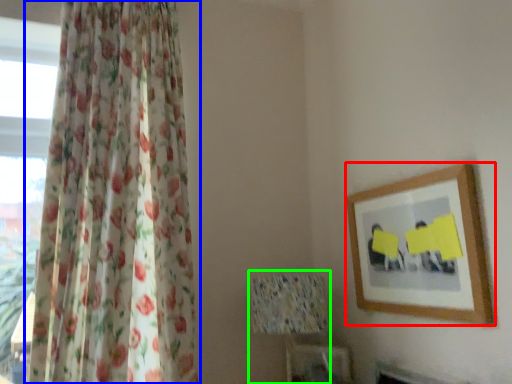
Question: Estimate the real-world distances between objects in this image. Which object is closer to picture frame (highlighted by a red box), curtain (highlighted by a blue box) or table lamp (highlighted by a green box)?

Choices:
 (A) curtain
 (B) table lamp

Answer: (B)